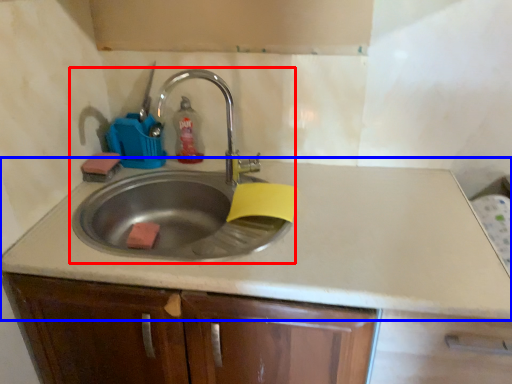
Question: Which point is further to the camera, sink (highlighted by a red box) or countertop (highlighted by a blue box)?

Choices:
 (A) sink
 (B) countertop

Answer: (A)